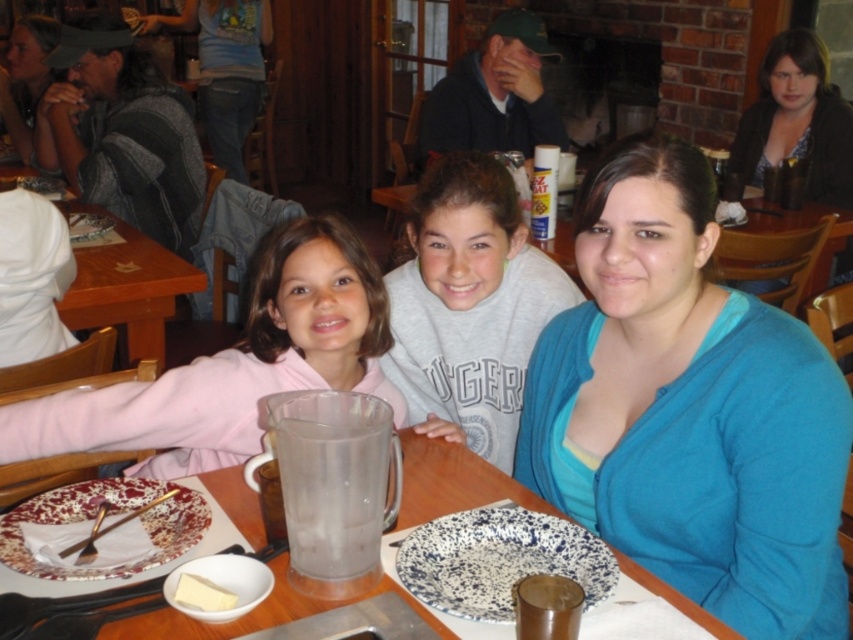
Question: Is matte plastic pitcher at center further to camera compared to yellow butter at lower left?

Choices:
 (A) no
 (B) yes

Answer: (B)

Question: Is speckled ceramic plate at lower center wider than matte black hat at upper left?

Choices:
 (A) no
 (B) yes

Answer: (A)

Question: Can you confirm if clear plastic pitcher at center is thinner than wooden table at center?

Choices:
 (A) no
 (B) yes

Answer: (A)

Question: Which object is positioned farthest from the matte black hat at upper left?

Choices:
 (A) wooden table at center
 (B) matte plastic pitcher at center
 (C) speckled ceramic plate at lower left

Answer: (B)

Question: Which of these objects is positioned closest to the blue cotton shirt at center?

Choices:
 (A) pink fleece jacket at left
 (B) speckled ceramic plate at lower left
 (C) wooden table at center

Answer: (A)

Question: Which of these objects is positioned farthest from the matte black jacket at upper right?

Choices:
 (A) speckled ceramic plate at lower center
 (B) matte black hat at upper left
 (C) matte plastic pitcher at center
 (D) yellow butter at lower left

Answer: (B)